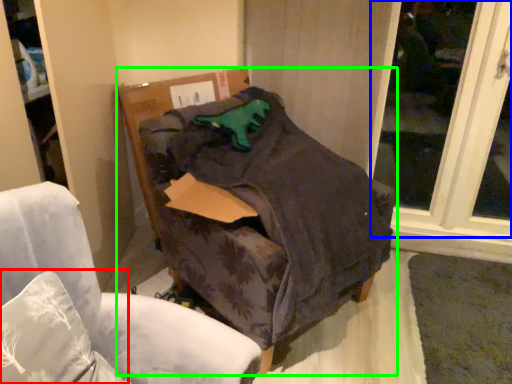
Question: Based on their relative distances, which object is nearer to pillow (highlighted by a red box)? Choose from window (highlighted by a blue box) and furniture (highlighted by a green box).

Choices:
 (A) window
 (B) furniture

Answer: (B)